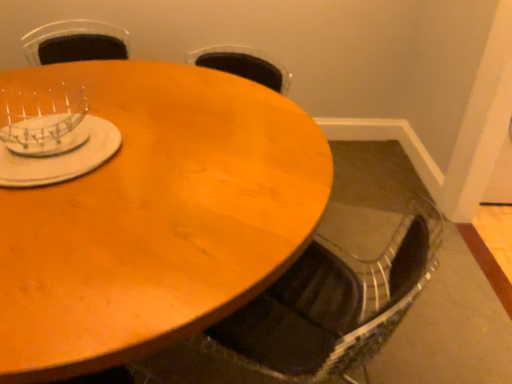
What are the coordinates of `space that is in front of white matte plate at upper left, which is the 2th tableware from top to bottom` in the screenshot? It's located at (61, 227).